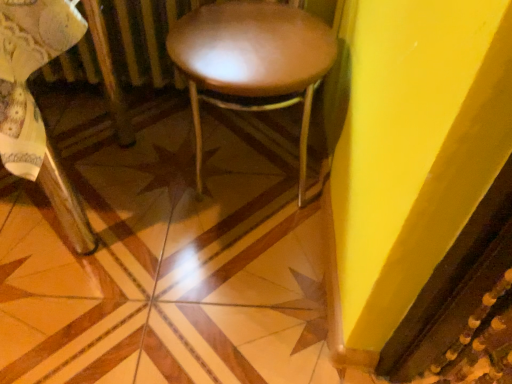
I want to click on vacant area situated below leather-like brown stool at center (from a real-world perspective), so click(245, 165).